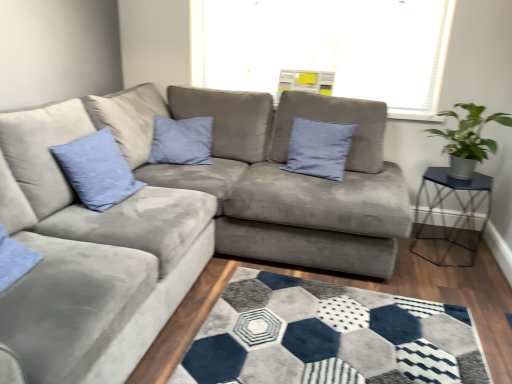
Question: Looking at their shapes, would you say blue fabric pillow at center, the 2th pillow in the front-to-back sequence, is wider or thinner than green leafy plant in metallic pot at right?

Choices:
 (A) thin
 (B) wide

Answer: (A)

Question: In terms of size, does blue fabric pillow at center, the 2th pillow in the front-to-back sequence, appear bigger or smaller than green leafy plant in metallic pot at right?

Choices:
 (A) small
 (B) big

Answer: (A)

Question: Considering the real-world distances, which object is closest to the green leafy plant in metallic pot at right?

Choices:
 (A) metallic blue glass table at right
 (B) suede gray couch at center
 (C) matte blue cushion at upper left, acting as the 2th pillow starting from the right
 (D) blue fabric pillow at center, which is the second pillow from left to right

Answer: (A)

Question: Based on their relative distances, which object is farther from the green leafy plant in metallic pot at right?

Choices:
 (A) suede gray couch at center
 (B) metallic blue glass table at right
 (C) matte blue cushion at upper left, the 1th pillow positioned from the front
 (D) blue fabric pillow at center, the first pillow positioned from the back

Answer: (C)